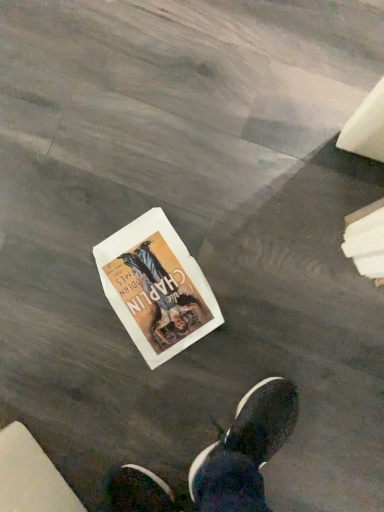
Locate an element on the screen. The width and height of the screenshot is (384, 512). free space above white paper at center (from a real-world perspective) is located at coordinates point(144,281).